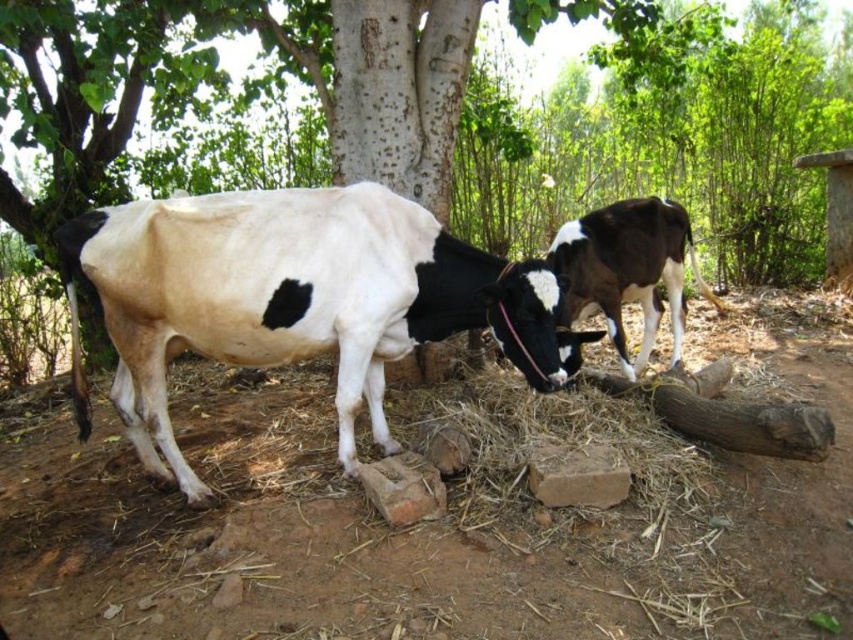
Question: Can you confirm if brown soil at center is positioned to the left of black and white cow at center?

Choices:
 (A) yes
 (B) no

Answer: (A)

Question: Based on their relative distances, which object is farther from the black and white cow at center?

Choices:
 (A) brown soil at center
 (B) rough bark tree at center
 (C) black and white cow at right

Answer: (B)

Question: Is brown soil at center further to the viewer compared to black and white cow at center?

Choices:
 (A) no
 (B) yes

Answer: (A)

Question: Does rough bark tree at center appear under black and white cow at center?

Choices:
 (A) no
 (B) yes

Answer: (B)

Question: Among these objects, which one is nearest to the camera?

Choices:
 (A) black and white cow at right
 (B) black and white cow at center

Answer: (B)

Question: Based on their relative distances, which object is nearer to the black and white cow at center?

Choices:
 (A) rough bark tree at center
 (B) black and white cow at right

Answer: (B)